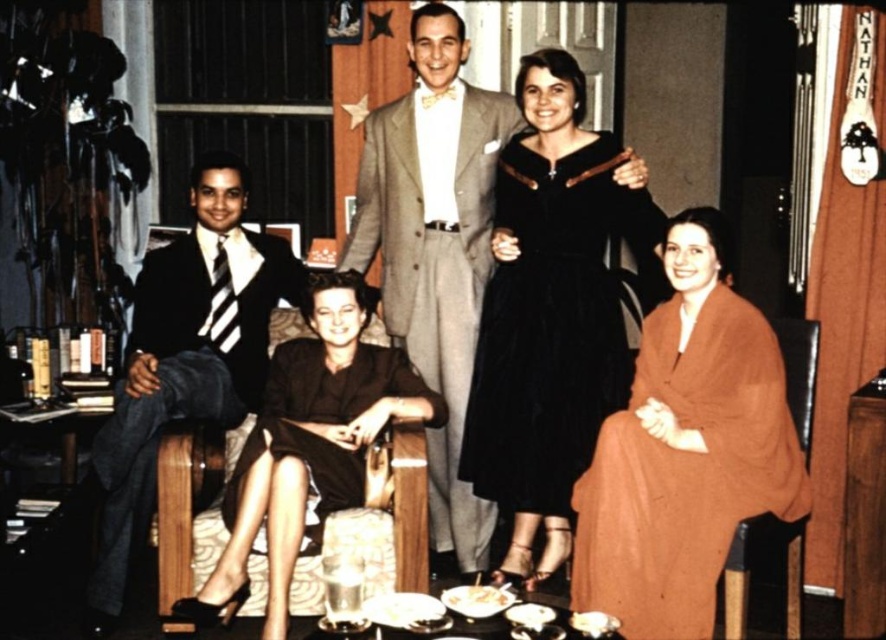
Who is more distant from viewer, [543,180] or [368,208]?

Point [368,208]

Looking at this image, does velvet black dress at center come in front of light gray wool suit at center?

Yes.

Measure the distance between velvet black dress at center and camera.

velvet black dress at center is 9.93 feet away from camera.

At what (x,y) coordinates should I click in order to perform the action: click on velvet black dress at center. Please return your answer as a coordinate pair (x, y). Looking at the image, I should click on (550, 324).

Which is behind, point (572, 556) or point (416, 161)?

Positioned behind is point (416, 161).

Who is higher up, brown woolen shawl at lower right or light gray wool suit at center?

light gray wool suit at center is above.

The height and width of the screenshot is (640, 886). I want to click on brown woolen shawl at lower right, so click(686, 449).

Is velvet black dress at center above brown satin dress at center?

Yes.

You are a GUI agent. You are given a task and a screenshot of the screen. Output one action in this format:
    pyautogui.click(x=<x>, y=<y>)
    Task: Click on the velvet black dress at center
    This screenshot has height=640, width=886.
    Given the screenshot: What is the action you would take?
    pyautogui.click(x=550, y=324)